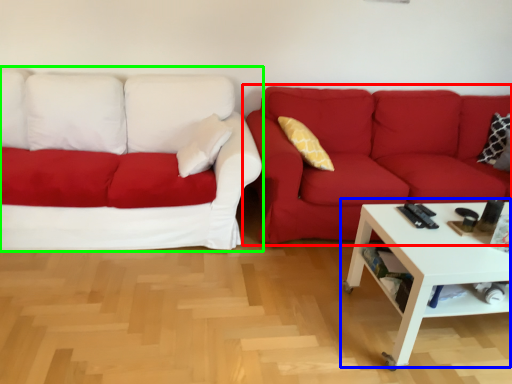
Question: Considering the real-world distances, which object is closest to studio couch (highlighted by a red box)? coffee table (highlighted by a blue box) or studio couch (highlighted by a green box).

Choices:
 (A) coffee table
 (B) studio couch

Answer: (A)